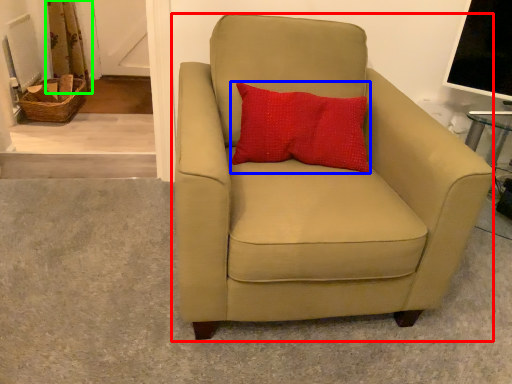
Question: Which object is positioned closest to chair (highlighted by a red box)? Select from pillow (highlighted by a blue box) and curtain (highlighted by a green box).

Choices:
 (A) pillow
 (B) curtain

Answer: (A)